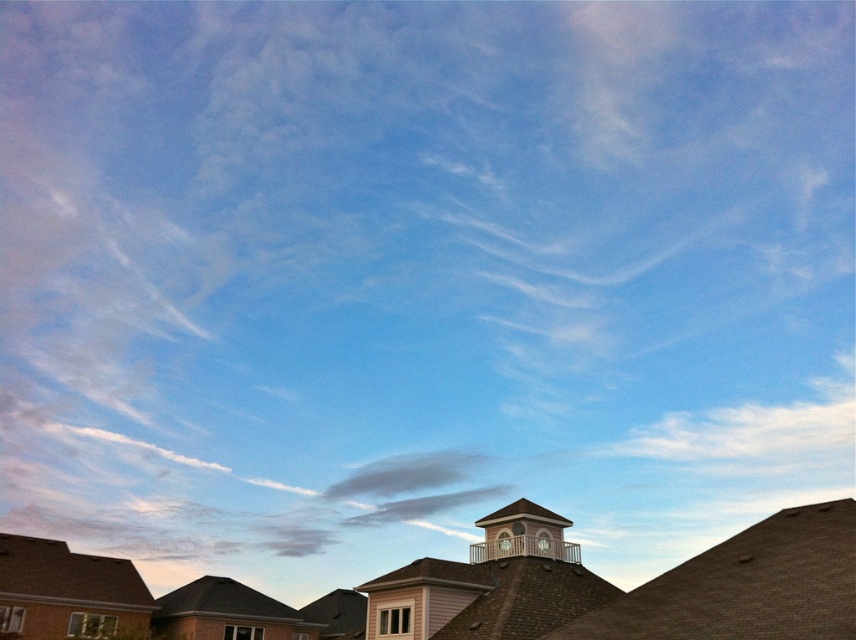
Question: Does white wooden bell tower at center have a smaller size compared to matte white clock at upper center?

Choices:
 (A) no
 (B) yes

Answer: (A)

Question: Does black shingles at center appear under white glossy clock at upper center?

Choices:
 (A) yes
 (B) no

Answer: (A)

Question: Which is farther from the brown shingles at lower left?

Choices:
 (A) white wooden bell tower at center
 (B) black shingles at center
 (C) brown shingles at center
 (D) matte white clock at upper center

Answer: (D)

Question: Can you confirm if brown shingles at lower left is positioned above black shingles at center?

Choices:
 (A) no
 (B) yes

Answer: (B)

Question: Which of the following is the closest to the observer?

Choices:
 (A) (559, 557)
 (B) (516, 580)
 (C) (812, 618)

Answer: (C)

Question: Which point is closer to the camera?

Choices:
 (A) (462, 628)
 (B) (123, 588)
 (C) (794, 568)

Answer: (C)